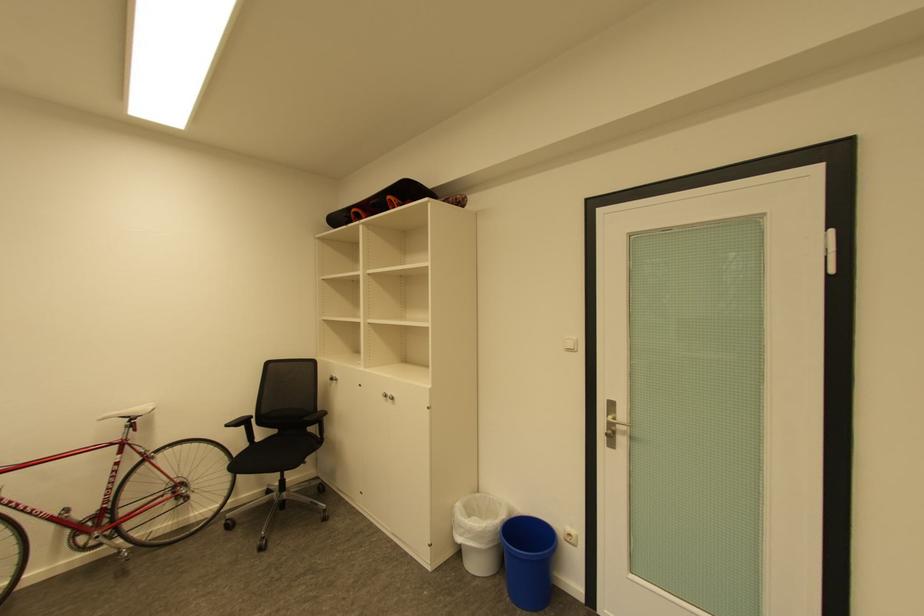
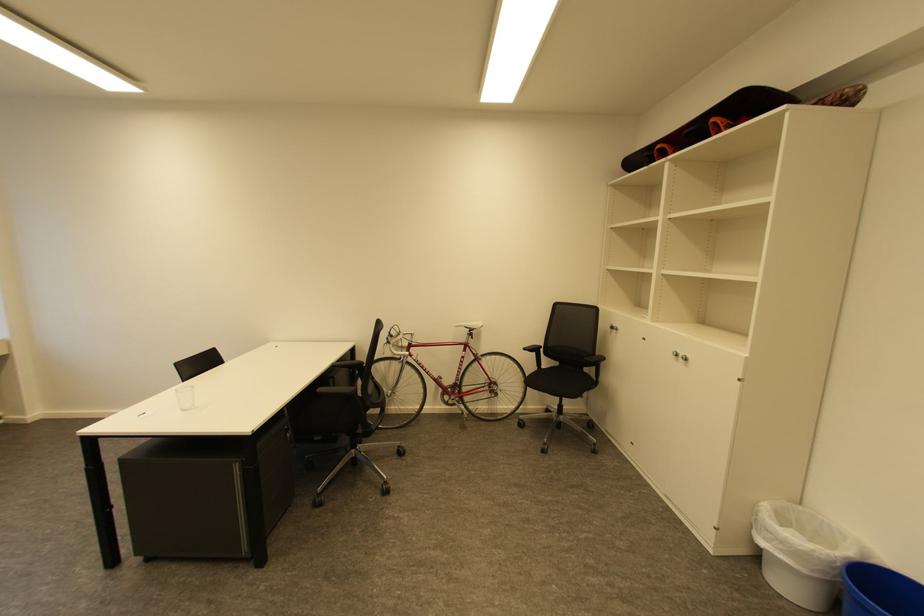
Find the pixel in the second image that matches the point at 128,453 in the first image.

(471, 351)